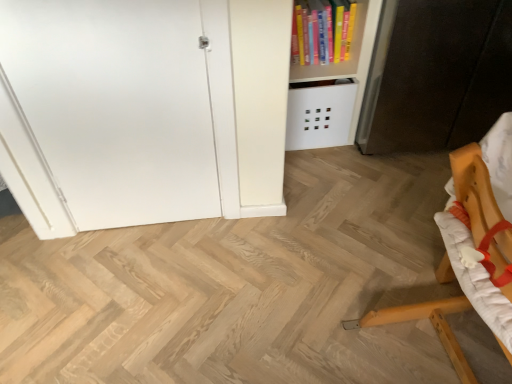
Question: From a real-world perspective, is dark brown wood cabinet at right above or below wooden chair at lower right?

Choices:
 (A) below
 (B) above

Answer: (B)

Question: From the image's perspective, is dark brown wood cabinet at right positioned above or below wooden chair at lower right?

Choices:
 (A) below
 (B) above

Answer: (B)

Question: Considering the real-world distances, which object is closest to the white matte door at left?

Choices:
 (A) dark brown wood cabinet at right
 (B) wooden chair at lower right
 (C) hardcover book at upper right

Answer: (C)

Question: Based on their relative distances, which object is farther from the hardcover book at upper right?

Choices:
 (A) wooden chair at lower right
 (B) white matte door at left
 (C) dark brown wood cabinet at right

Answer: (A)